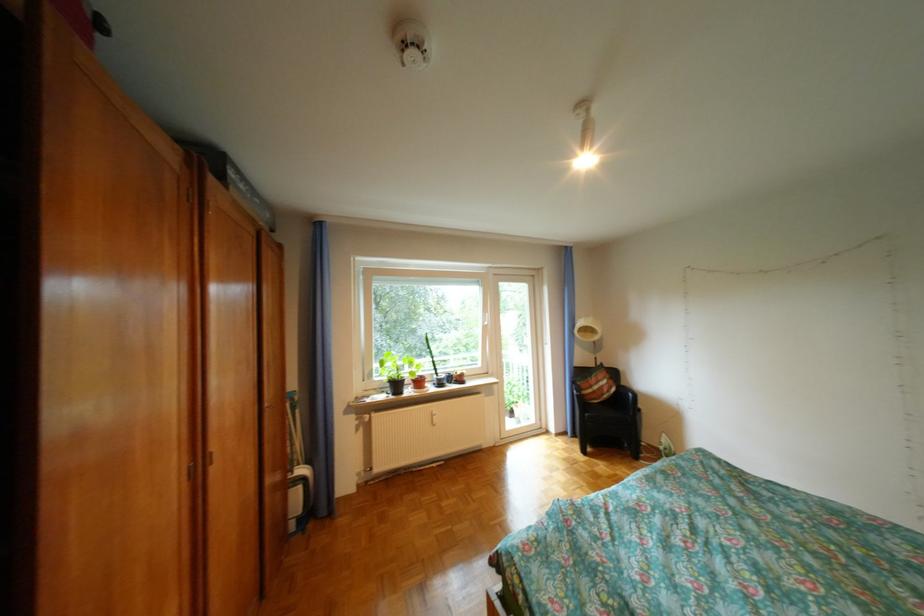
At what (x,y) coordinates should I click in order to perform the action: click on white door handle. Please return your answer as a coordinate pair (x, y). Looking at the image, I should click on (485, 317).